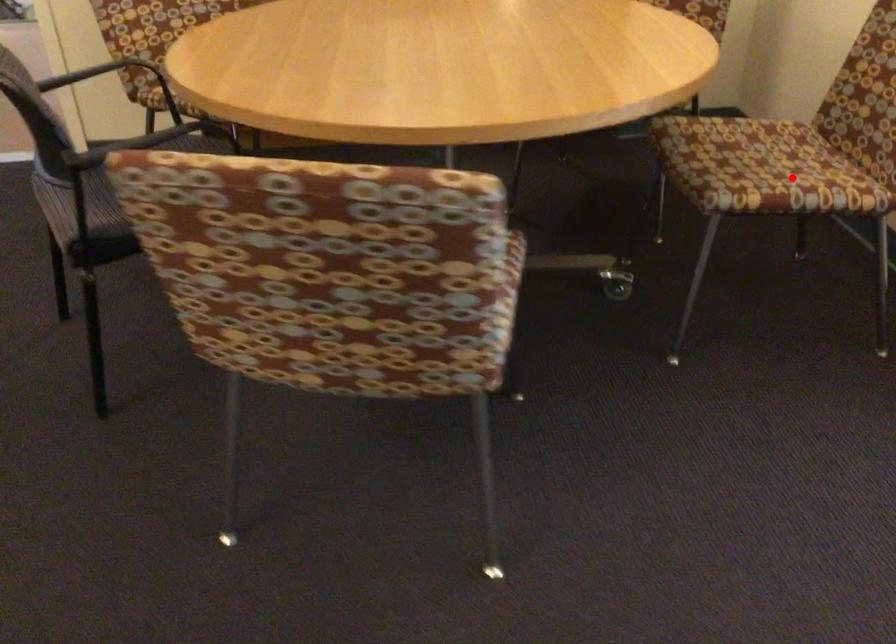
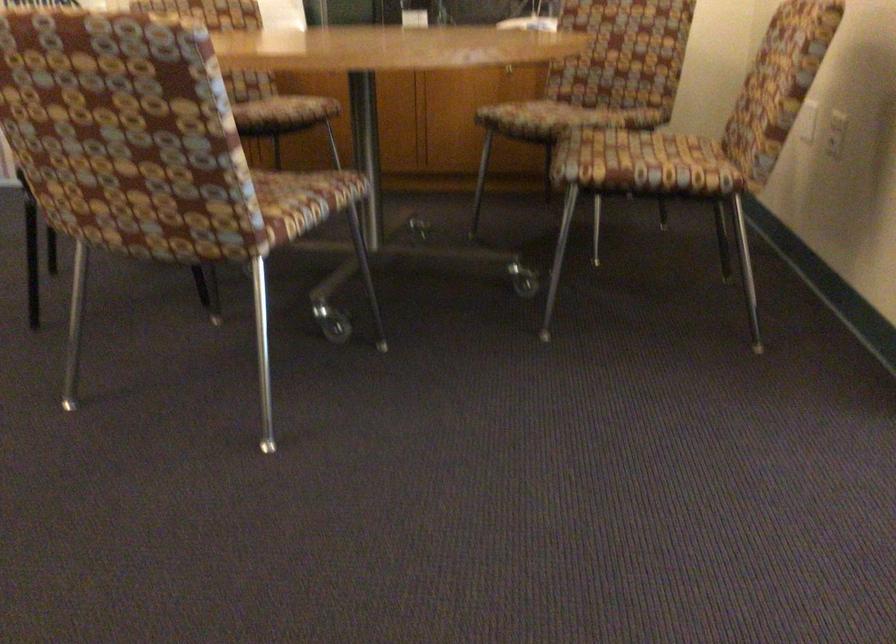
The point at the highlighted location is marked in the first image. Where is the corresponding point in the second image?

(643, 164)